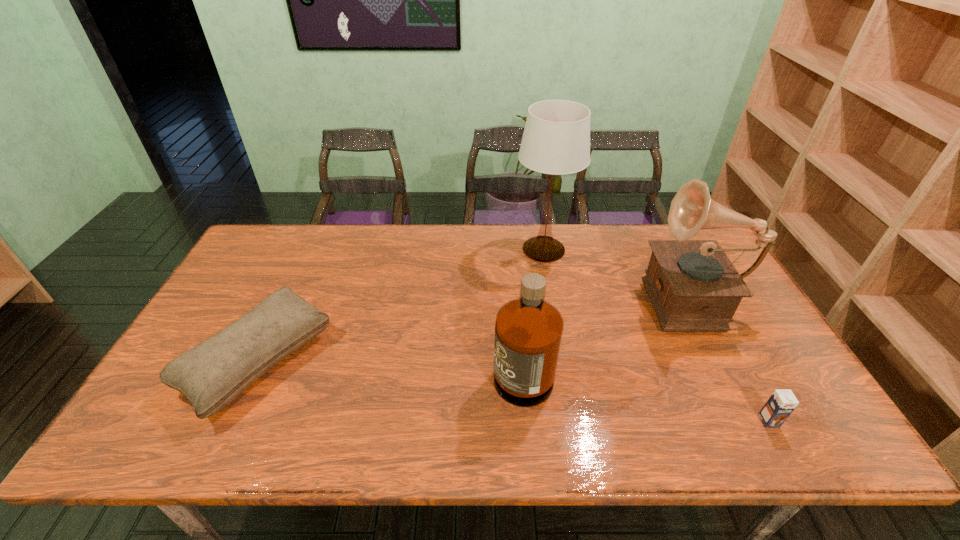
Image resolution: width=960 pixels, height=540 pixels. What are the coordinates of `object that ranks as the third closest to the shortest object` in the screenshot? It's located at (556, 141).

At what (x,y) coordinates should I click in order to perform the action: click on vacant area that satisfies the following two spatial constraints: 1. above the cylindrical shade of the table lamp; 2. on the front label of the third shortest object. Please return your answer as a coordinate pair (x, y). This screenshot has width=960, height=540. Looking at the image, I should click on (564, 363).

Locate an element on the screen. The height and width of the screenshot is (540, 960). blank space that satisfies the following two spatial constraints: 1. on the horn of the record player; 2. on the front side of the cushion is located at coordinates (720, 360).